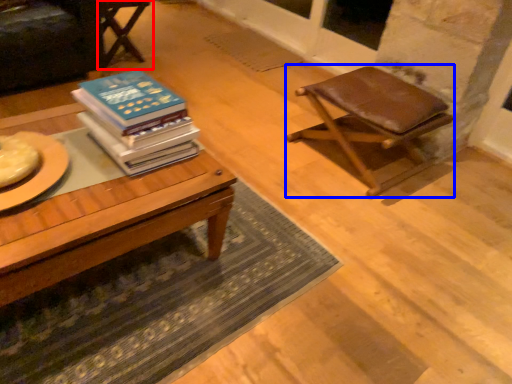
Question: Which point is closer to the camera, chair (highlighted by a red box) or stool (highlighted by a blue box)?

Choices:
 (A) chair
 (B) stool

Answer: (B)